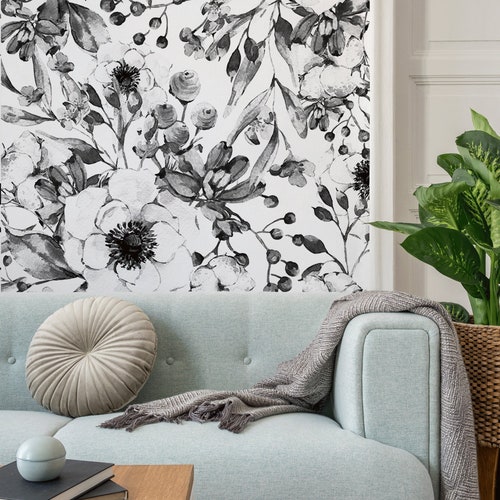
Locate an element on the screen. This screenshot has height=500, width=500. wicker basket is located at coordinates (483, 348).